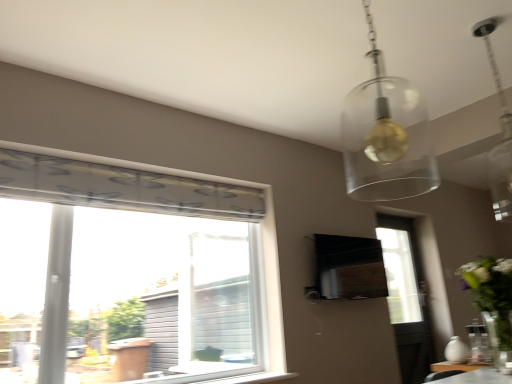
Question: Is clear glass pendant light at upper right wider than white glossy vase at right?

Choices:
 (A) no
 (B) yes

Answer: (A)

Question: From the image's perspective, is clear glass pendant light at upper right above white glossy vase at right?

Choices:
 (A) yes
 (B) no

Answer: (A)

Question: From the image's perspective, would you say clear glass pendant light at upper right is shown under white glossy vase at right?

Choices:
 (A) yes
 (B) no

Answer: (B)

Question: Can you confirm if clear glass pendant light at upper right is thinner than white glossy vase at right?

Choices:
 (A) yes
 (B) no

Answer: (A)

Question: Is clear glass pendant light at upper right located outside white glossy vase at right?

Choices:
 (A) no
 (B) yes

Answer: (B)

Question: Considering the relative sizes of clear glass pendant light at upper right and white glossy vase at right in the image provided, is clear glass pendant light at upper right smaller than white glossy vase at right?

Choices:
 (A) yes
 (B) no

Answer: (A)

Question: Is white matte vase at lower right far from black matte vent at center?

Choices:
 (A) yes
 (B) no

Answer: (B)

Question: Can black matte vent at center be found inside white matte vase at lower right?

Choices:
 (A) yes
 (B) no

Answer: (B)

Question: Considering the relative sizes of white matte vase at lower right and black matte vent at center in the image provided, is white matte vase at lower right bigger than black matte vent at center?

Choices:
 (A) yes
 (B) no

Answer: (B)

Question: From a real-world perspective, is white matte vase at lower right beneath black matte vent at center?

Choices:
 (A) no
 (B) yes

Answer: (B)

Question: Is white matte vase at lower right closer to the viewer compared to black matte vent at center?

Choices:
 (A) yes
 (B) no

Answer: (A)

Question: Is white matte vase at lower right oriented towards black matte vent at center?

Choices:
 (A) yes
 (B) no

Answer: (B)

Question: From the image's perspective, is translucent glass globe at upper center over white glossy vase at right?

Choices:
 (A) no
 (B) yes

Answer: (B)